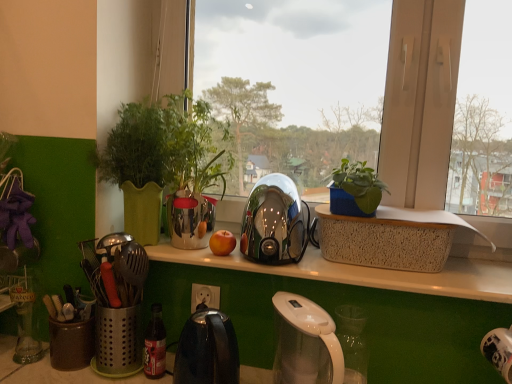
Question: Visually, is metallic utensil holder at left positioned to the left or to the right of matte plastic bottle at lower center?

Choices:
 (A) left
 (B) right

Answer: (A)

Question: Based on their sizes in the image, would you say metallic utensil holder at left is bigger or smaller than matte plastic bottle at lower center?

Choices:
 (A) big
 (B) small

Answer: (A)

Question: Based on their relative distances, which object is nearer to the white speckled tray at center?

Choices:
 (A) metallic utensil holder at left
 (B) matte plastic bottle at lower center
 (C) shiny black kettle at center, which appears as the 2th kettle when viewed from the top
 (D) metallic silver kettle at center
 (E) white glossy power outlet at center

Answer: (A)

Question: Estimate the real-world distances between objects in this image. Which object is farther from the red matte apple at center?

Choices:
 (A) white glossy power outlet at center
 (B) shiny metallic kettle at center, placed as the 1th kettle when sorted from top to bottom
 (C) shiny black kettle at center, the first kettle in the bottom-to-top sequence
 (D) metallic silver kettle at center
 (E) white translucent coffee maker at lower center

Answer: (D)